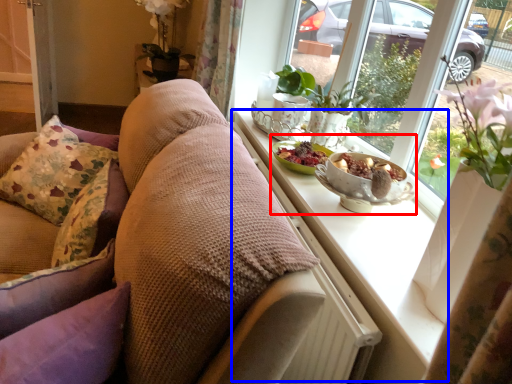
Question: Which point is further to the camera, fruit dish (highlighted by a red box) or window sill (highlighted by a blue box)?

Choices:
 (A) fruit dish
 (B) window sill

Answer: (A)